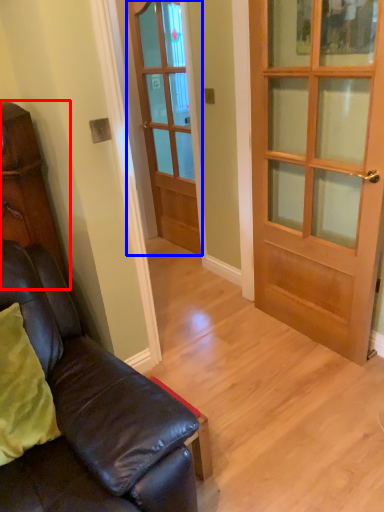
Question: Among these objects, which one is nearest to the camera, cabinetry (highlighted by a red box) or door (highlighted by a blue box)?

Choices:
 (A) cabinetry
 (B) door

Answer: (A)